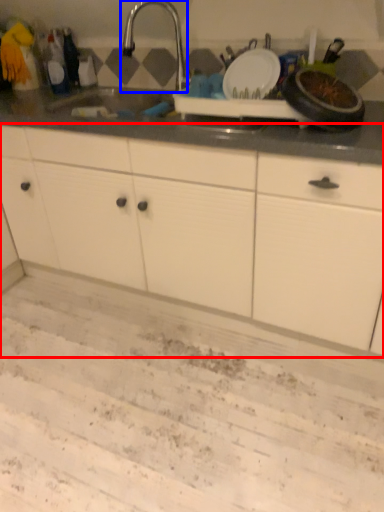
Question: Which of the following is the farthest to the observer, cabinetry (highlighted by a red box) or tap (highlighted by a blue box)?

Choices:
 (A) cabinetry
 (B) tap

Answer: (B)